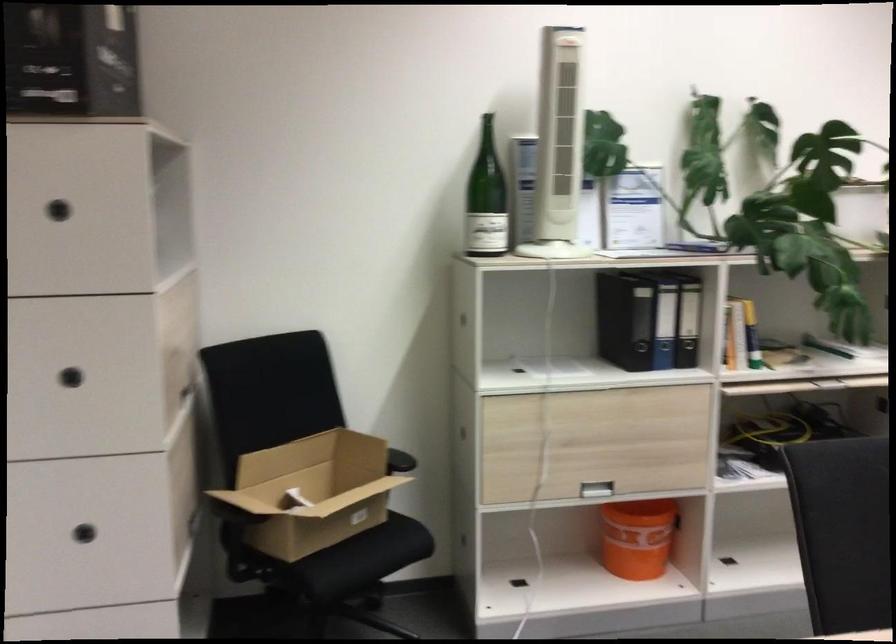
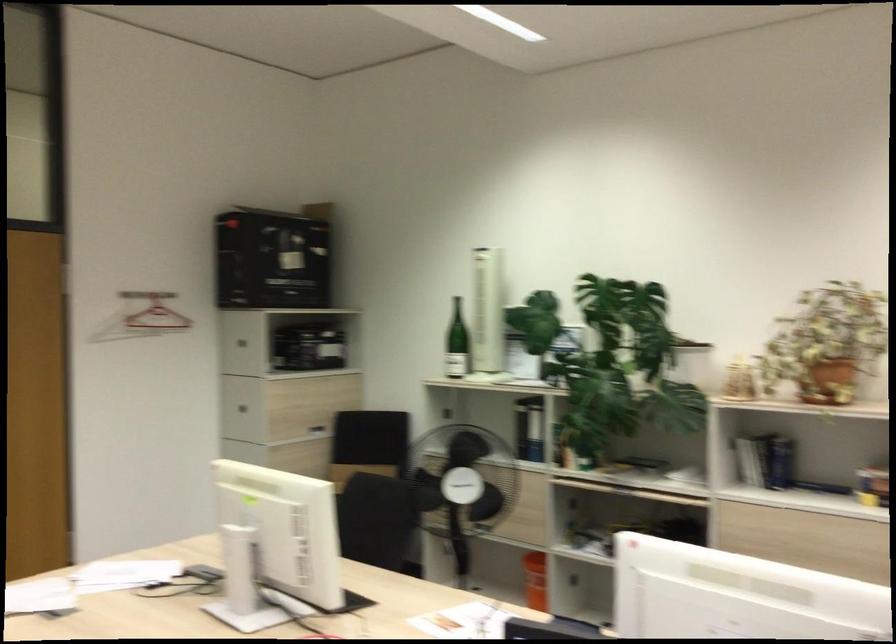
Question: I am providing you with two images of the same scene from different viewpoints. Which of the following objects are not visible in image2?

Choices:
 (A) dark drawer handle
 (B) blue aerosol can
 (C) red clothes hanger
 (D) black binder

Answer: (A)